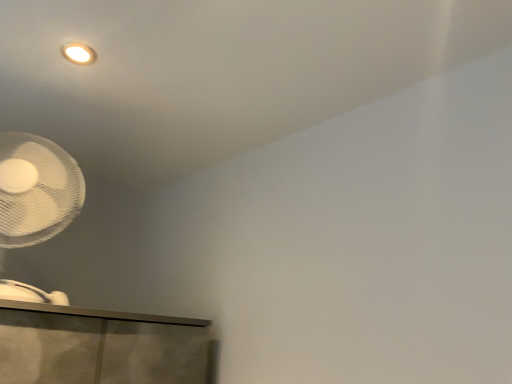
Question: Should I look upward or downward to see white matte mechanical fan at lower left?

Choices:
 (A) up
 (B) down

Answer: (B)